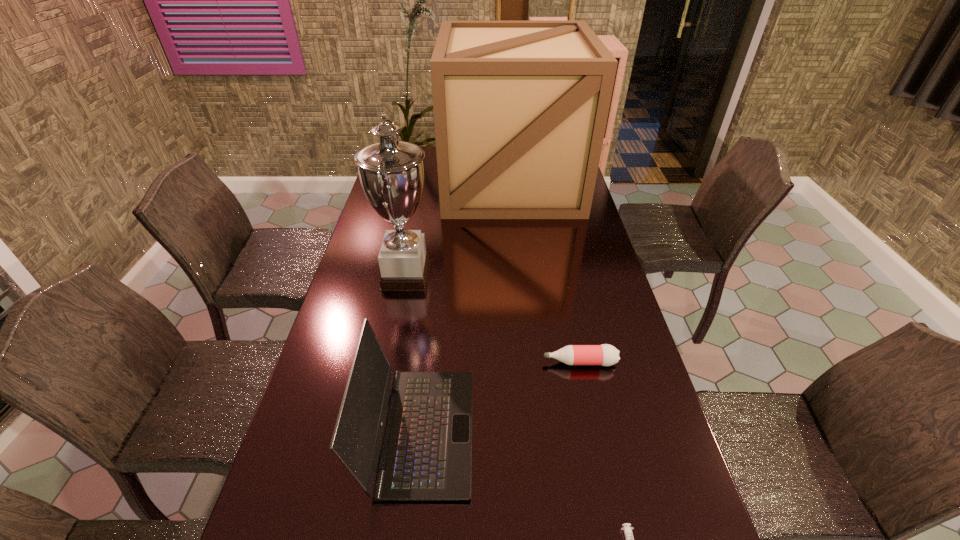
This screenshot has height=540, width=960. I want to click on vacant space located 0.140m with the cap open on the second shortest object, so click(x=492, y=362).

At what (x,y) coordinates should I click in order to perform the action: click on free space located with the cap open on the second shortest object. Please return your answer as a coordinate pair (x, y). The image size is (960, 540). Looking at the image, I should click on (484, 362).

In order to click on object situated at the far edge in this screenshot , I will do `click(520, 108)`.

Where is `object situated at the left edge`? object situated at the left edge is located at coordinates (391, 172).

Where is `box located at the right edge`? The width and height of the screenshot is (960, 540). box located at the right edge is located at coordinates (520, 108).

This screenshot has width=960, height=540. In order to click on bottle located in the right edge section of the desktop in this screenshot , I will do `click(606, 355)`.

Locate an element on the screen. object located in the far right corner section of the desktop is located at coordinates (520, 108).

Where is `vacant space at the left edge`? Image resolution: width=960 pixels, height=540 pixels. vacant space at the left edge is located at coordinates (369, 275).

In the image, there is a desktop. In order to click on free region at the right edge in this screenshot , I will do `click(581, 248)`.

I want to click on blank region between the third farthest object and the third tallest object, so click(499, 397).